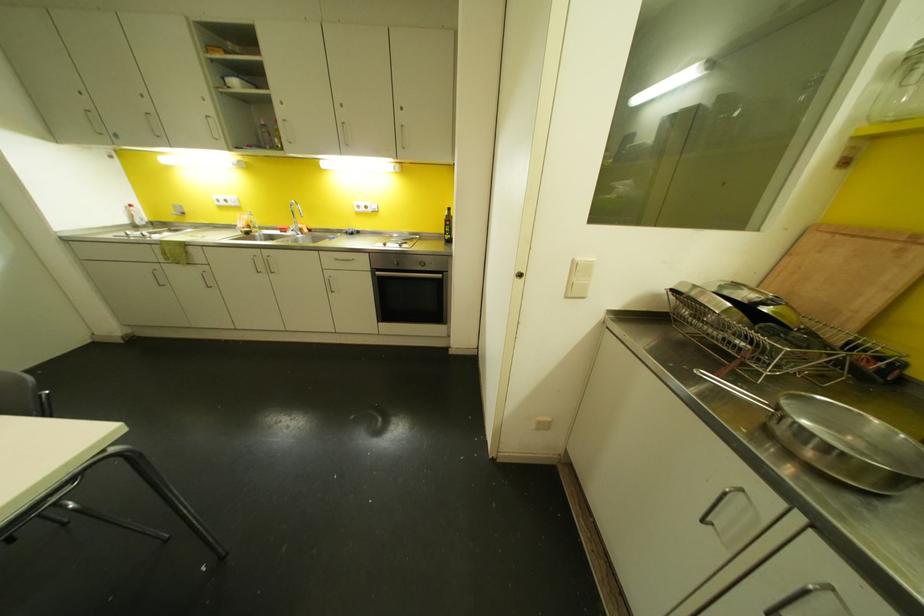
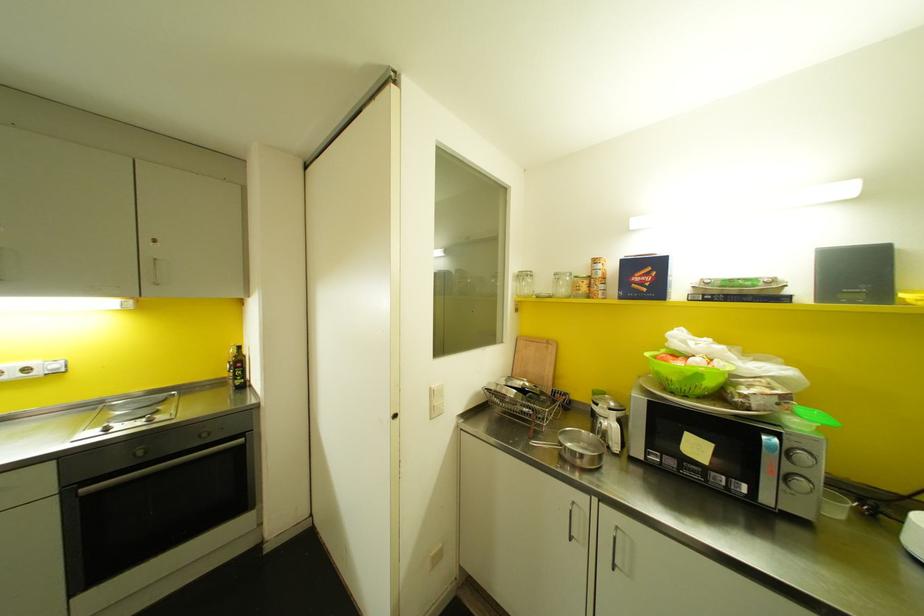
Locate, in the second image, the point that corresponds to point (573, 259) in the first image.

(430, 387)